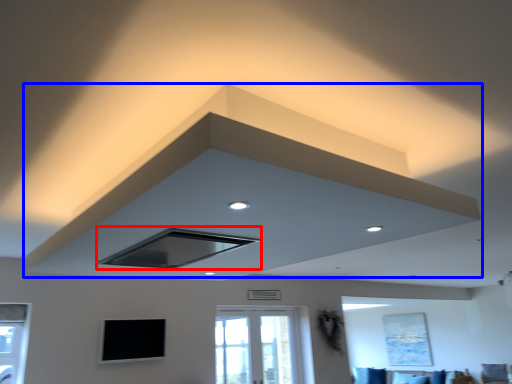
Question: Which point is closer to the camera, exhaust hood (highlighted by a red box) or exhaust hood (highlighted by a blue box)?

Choices:
 (A) exhaust hood
 (B) exhaust hood

Answer: (B)